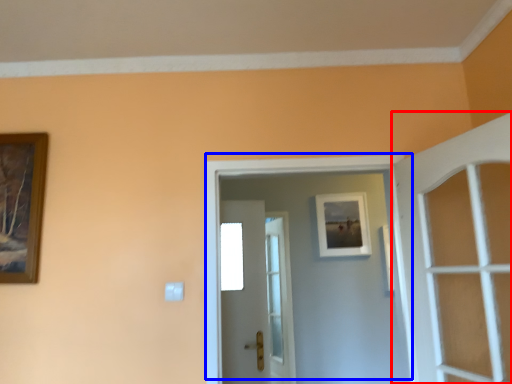
Question: Which point is closer to the camera, door (highlighted by a red box) or door (highlighted by a blue box)?

Choices:
 (A) door
 (B) door

Answer: (A)